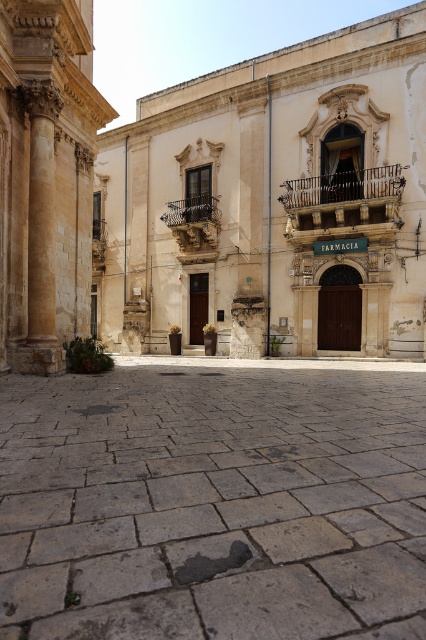
You are standing in the historic urban scene and want to take a photo of the golden stone column at left. Where should you position yourself relative to the gray stone plaza at center to ensure the column is fully visible in the frame?

To ensure the golden stone column at left is fully visible in the frame, position yourself above the gray stone plaza at center since the gray stone plaza at center is located below the golden stone column at left.

You are standing at the point with coordinates point (0,212) and want to walk to the point with coordinates point (161,556). Which direction should you face to move towards your destination?

You should face towards the direction of point (161,556), which is in front of point (0,212).